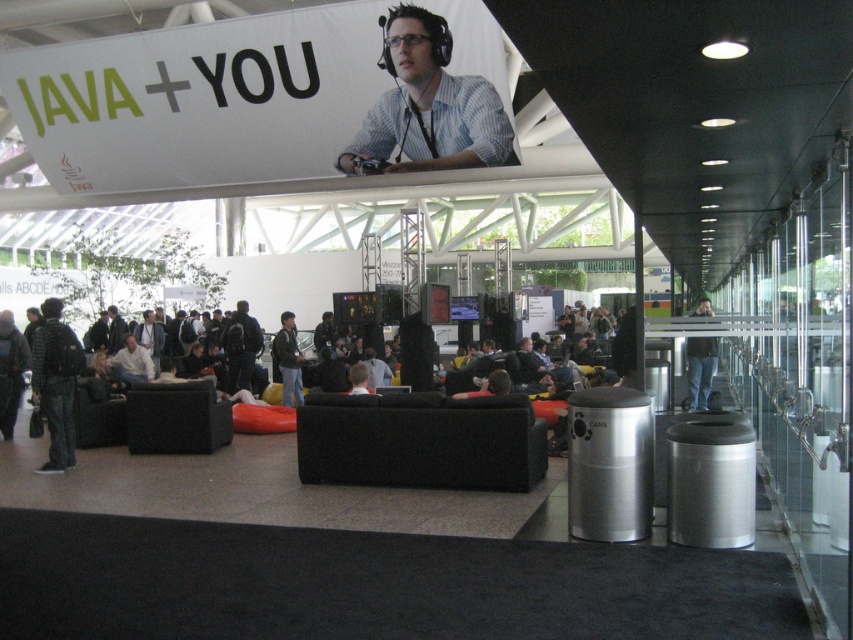
You are attending an event and see a person wearing a matte black shirt at center and dark blue jeans at left. Which piece of clothing is covering the other?

The matte black shirt at center is positioned over the dark blue jeans at left, so the shirt is covering the jeans.

You are standing in the conference hall and see a point marked at coordinates [700,369]. What object is this point located on?

The point at [700,369] is located on the jeans at center.

You are a photographer setting up for an event and need to position a camera on a tripod. The camera requires a minimum of 1.2 meters of clearance from the floor to the top of the tripod. You have two options for placement near the matte black shirt at center and dark blue jeans at left. Based on their heights, will either location allow the tripod to be set up without exceeding the height requirement?

The matte black shirt at center has a lesser height compared to dark blue jeans at left. Since the camera requires a minimum clearance of 1.2 meters, we need to compare the heights of both objects. However, the exact heights aren